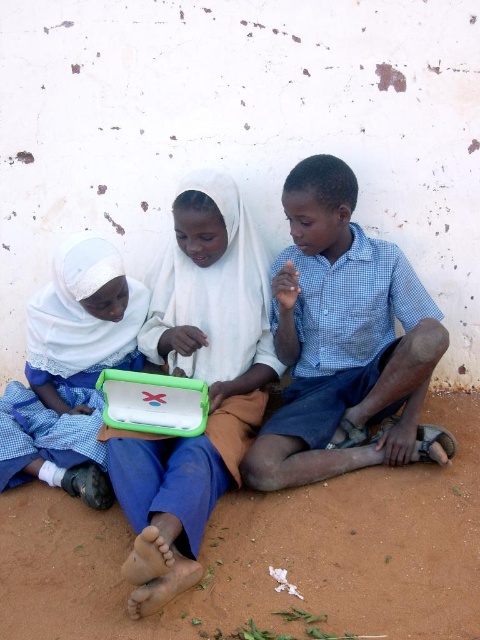
In the scene shown: Who is positioned more to the right, blue checkered shirt at center or matte green plastic tablet at center?

Positioned to the right is blue checkered shirt at center.

Who is more distant from viewer, (330, 179) or (48, 384)?

The point (48, 384) is more distant.

At what (x,y) coordinates should I click in order to perform the action: click on blue checkered shirt at center. Please return your answer as a coordinate pair (x, y). Image resolution: width=480 pixels, height=640 pixels. Looking at the image, I should click on pyautogui.click(x=342, y=339).

Is green plastic tablet at center closer to camera compared to matte green plastic tablet at center?

Yes, green plastic tablet at center is closer to the viewer.

Can you confirm if green plastic tablet at center is positioned to the right of matte green plastic tablet at center?

Indeed, green plastic tablet at center is positioned on the right side of matte green plastic tablet at center.

This screenshot has width=480, height=640. I want to click on green plastic tablet at center, so click(x=199, y=378).

Can you confirm if blue checkered shirt at center is taller than green plastic tablet at center?

In fact, blue checkered shirt at center may be shorter than green plastic tablet at center.

Is point (333, 195) positioned behind point (213, 490)?

That is True.

Where is `blue checkered shirt at center`? blue checkered shirt at center is located at coordinates pyautogui.click(x=342, y=339).